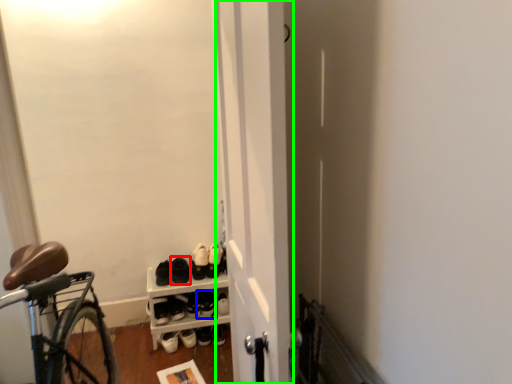
Question: Considering the real-world distances, which object is farthest from footwear (highlighted by a red box)? footwear (highlighted by a blue box) or door (highlighted by a green box)?

Choices:
 (A) footwear
 (B) door

Answer: (B)